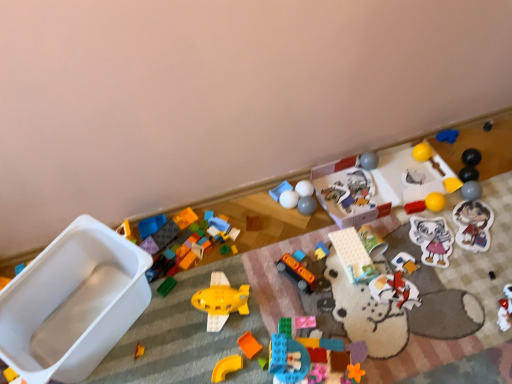
Identify the location of vacant area located to the right-hand side of translucent plastic blocks at center, arranged as the 11th toy when viewed from the left. (375, 345).